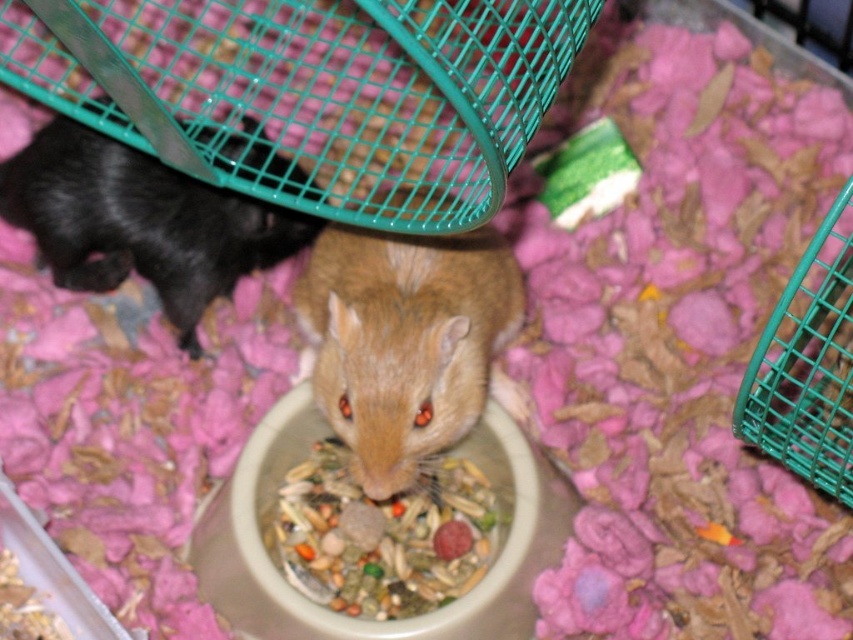
Does fuzzy brown hamster at center have a greater width compared to black matte/black fur mouse at left?

→ Incorrect, fuzzy brown hamster at center's width does not surpass black matte/black fur mouse at left's.

Is the position of fuzzy brown hamster at center more distant than that of black matte/black fur mouse at left?

No.

I want to click on fuzzy brown hamster at center, so click(404, 340).

Can you confirm if fuzzy brown hamster at center is positioned to the right of multicolored grain mix at center?

Correct, you'll find fuzzy brown hamster at center to the right of multicolored grain mix at center.

This screenshot has height=640, width=853. What do you see at coordinates (404, 340) in the screenshot?
I see `fuzzy brown hamster at center` at bounding box center [404, 340].

Is point (357, 316) behind point (352, 516)?

No, (357, 316) is in front of (352, 516).

At what (x,y) coordinates should I click in order to perform the action: click on fuzzy brown hamster at center. Please return your answer as a coordinate pair (x, y). The image size is (853, 640). Looking at the image, I should click on (404, 340).

Does black matte/black fur mouse at left appear over multicolored grain mix at center?

Indeed, black matte/black fur mouse at left is positioned over multicolored grain mix at center.

Is point (4, 192) farther from camera compared to point (445, 516)?

Yes, it is behind point (445, 516).

Find the location of a particular element. black matte/black fur mouse at left is located at coordinates point(140,221).